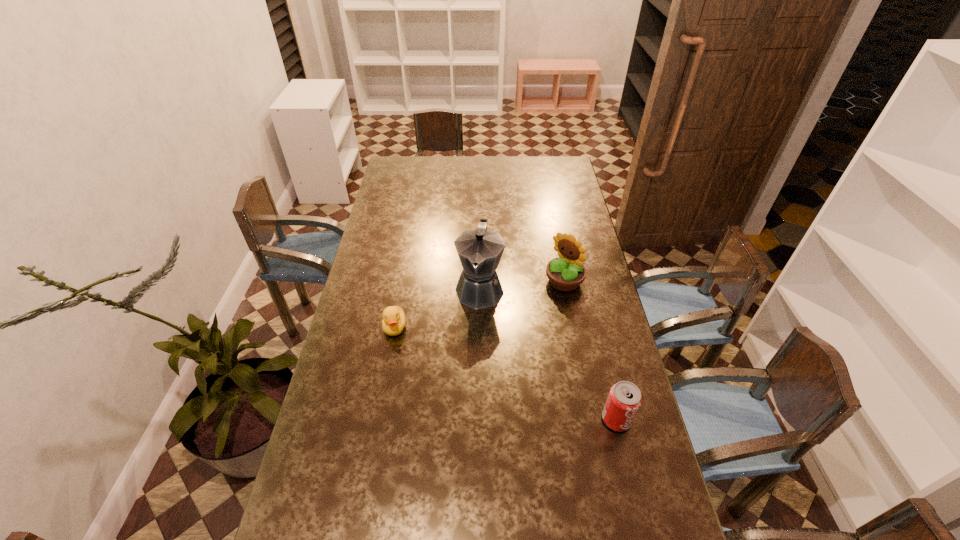
Where is `free space located 0.150m at the spout of the tallest object`? Image resolution: width=960 pixels, height=540 pixels. free space located 0.150m at the spout of the tallest object is located at coordinates (470, 348).

Find the location of a particular element. The width and height of the screenshot is (960, 540). free location located at the spout of the tallest object is located at coordinates (469, 353).

Where is `free space located 0.230m on the face of the sunflower`? This screenshot has width=960, height=540. free space located 0.230m on the face of the sunflower is located at coordinates (513, 327).

Find the location of `vacant area located on the face of the sunflower`. vacant area located on the face of the sunflower is located at coordinates (494, 342).

Where is `vacant region located on the face of the sunflower`? The height and width of the screenshot is (540, 960). vacant region located on the face of the sunflower is located at coordinates (525, 315).

Identify the location of object that is positioned at the left edge. The width and height of the screenshot is (960, 540). (394, 320).

Where is `soda can at the right edge`? soda can at the right edge is located at coordinates (624, 400).

What are the coordinates of `sunflower situated at the right edge` in the screenshot? It's located at (565, 273).

Image resolution: width=960 pixels, height=540 pixels. I want to click on free space at the far edge of the desktop, so click(x=462, y=166).

In the image, there is a desktop. Where is `vacant area at the left edge`? vacant area at the left edge is located at coordinates (387, 184).